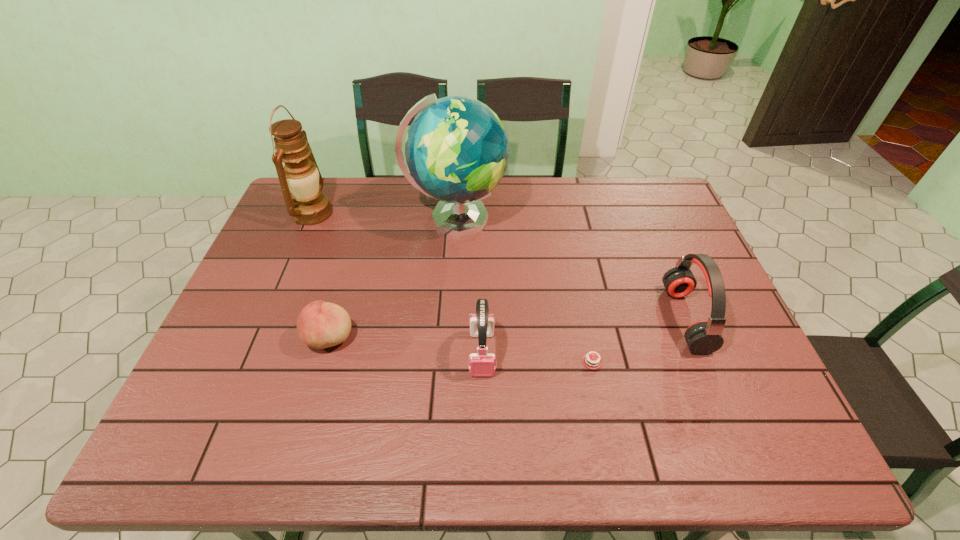
At what (x,y) coordinates should I click in order to perform the action: click on vacant area that lies between the left earphone and the shortest object. Please return your answer as a coordinate pair (x, y). Looking at the image, I should click on (537, 357).

Find the location of `empty space that is in between the left earphone and the oil lamp`. empty space that is in between the left earphone and the oil lamp is located at coordinates (397, 284).

What are the coordinates of `blank region between the left earphone and the oil lamp` in the screenshot? It's located at (397, 284).

Locate an element on the screen. This screenshot has height=540, width=960. empty space between the left earphone and the rightmost object is located at coordinates (584, 336).

Locate an element on the screen. vacant area that lies between the chocolate cake and the oil lamp is located at coordinates (452, 287).

Identify which object is located as the fourth nearest to the globe. Please provide its 2D coordinates. Your answer should be formatted as a tuple, i.e. [(x, y)], where the tuple contains the x and y coordinates of a point satisfying the conditions above.

[(588, 361)]

I want to click on object that ranks as the fifth closest to the right earphone, so click(x=308, y=206).

Find the location of `free location that satisfies the following two spatial constraints: 1. on the front side of the chocolate cake; 2. on the right side of the oil lamp`. free location that satisfies the following two spatial constraints: 1. on the front side of the chocolate cake; 2. on the right side of the oil lamp is located at coordinates (251, 361).

I want to click on free point that satisfies the following two spatial constraints: 1. on the outer surface of the fifth object from left to right; 2. on the right side of the left earphone, so click(x=482, y=361).

Where is `free spot that satisfies the following two spatial constraints: 1. on the ear cups of the right earphone; 2. on the outer surface of the left earphone`? This screenshot has width=960, height=540. free spot that satisfies the following two spatial constraints: 1. on the ear cups of the right earphone; 2. on the outer surface of the left earphone is located at coordinates (700, 354).